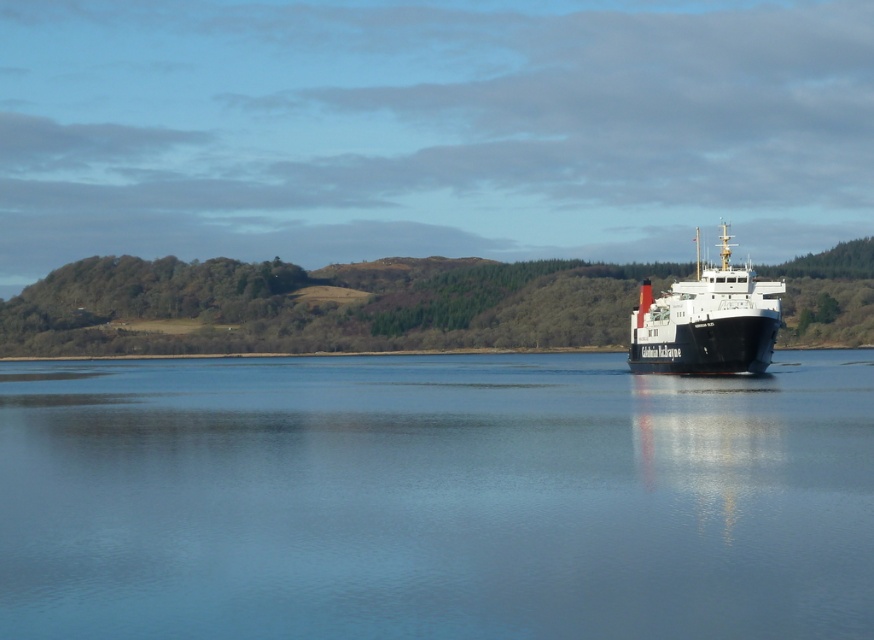
Can you confirm if blue water at center is taller than black matte ship at right?

In fact, blue water at center may be shorter than black matte ship at right.

Between point (503, 548) and point (737, 365), which one is positioned in front?

Point (503, 548) is more forward.

Is point (792, 624) more distant than point (663, 298)?

That is False.

Where is `blue water at center`? Image resolution: width=874 pixels, height=640 pixels. blue water at center is located at coordinates (435, 499).